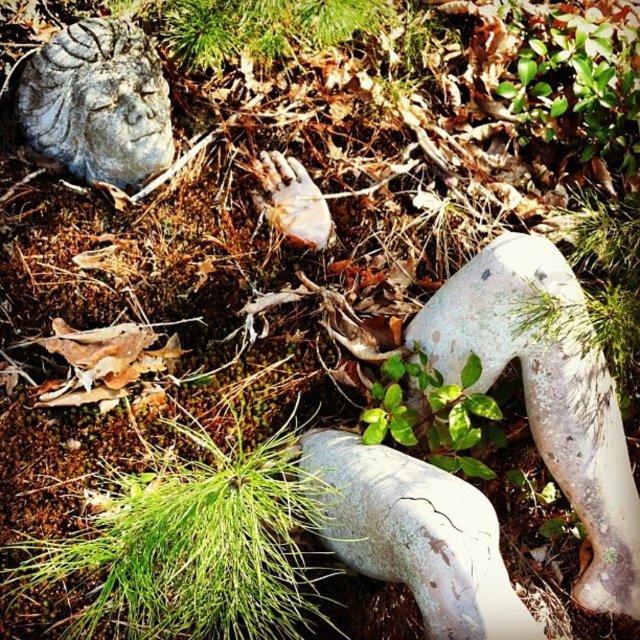
Question: Which point is farther to the camera?

Choices:
 (A) (49, 544)
 (B) (38, 116)
 (C) (632, 161)
 (D) (301, 456)

Answer: (C)

Question: Can you confirm if cracked stone leg at center is bigger than green leafy plant at upper right?

Choices:
 (A) yes
 (B) no

Answer: (B)

Question: Estimate the real-world distances between objects in this image. Which object is farther from the cracked stone leg at center?

Choices:
 (A) gray stone face at upper left
 (B) green grass at lower left
 (C) green leafy plant at center
 (D) green leafy plant at upper right

Answer: (D)

Question: Is green grass at lower left to the right of gray stone face at upper left from the viewer's perspective?

Choices:
 (A) yes
 (B) no

Answer: (A)

Question: Does cracked stone leg at center have a larger size compared to gray stone face at upper left?

Choices:
 (A) no
 (B) yes

Answer: (B)

Question: Which point is farther from the camera taking this photo?

Choices:
 (A) (60, 51)
 (B) (433, 440)
 (C) (312, 608)
 (D) (547, 131)

Answer: (D)